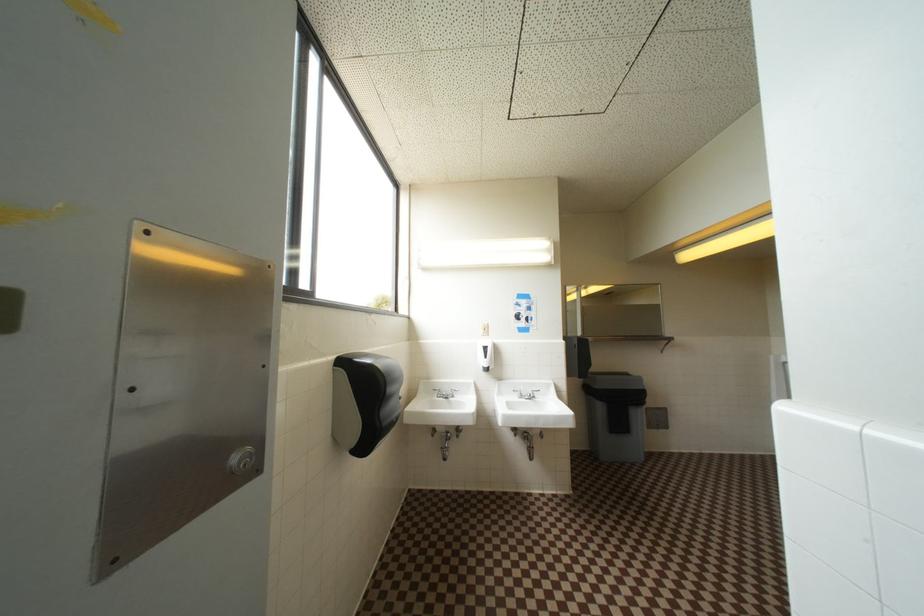
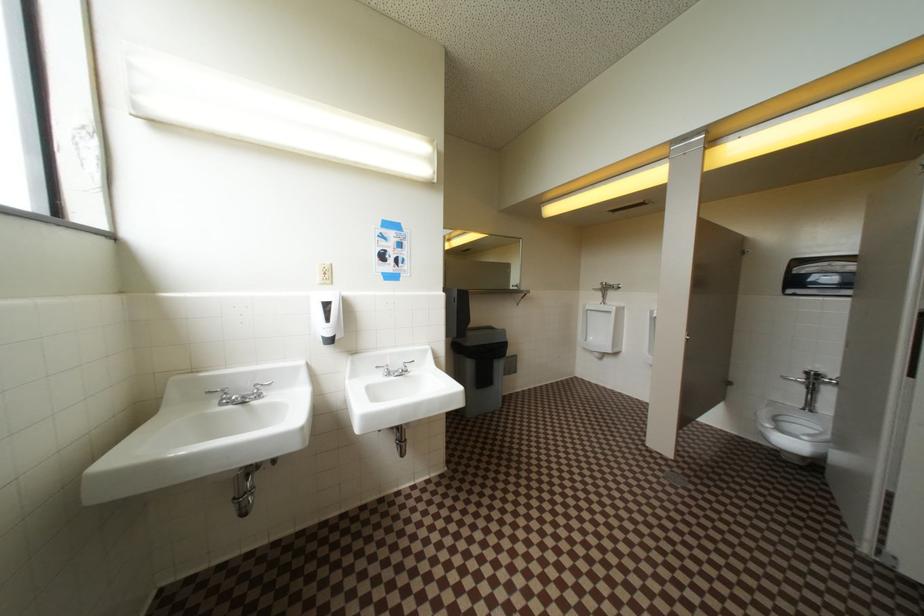
Question: The camera is either moving clockwise (left) or counter-clockwise (right) around the object. The first image is from the beginning of the video and the second image is from the end. Is the camera moving left or right when shooting the video?

Choices:
 (A) Left
 (B) Right

Answer: (A)